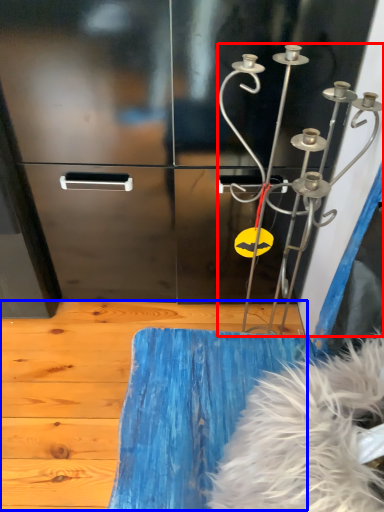
Question: Which of the following is the farthest to the observer, wind chime (highlighted by a red box) or plywood (highlighted by a blue box)?

Choices:
 (A) wind chime
 (B) plywood

Answer: (B)